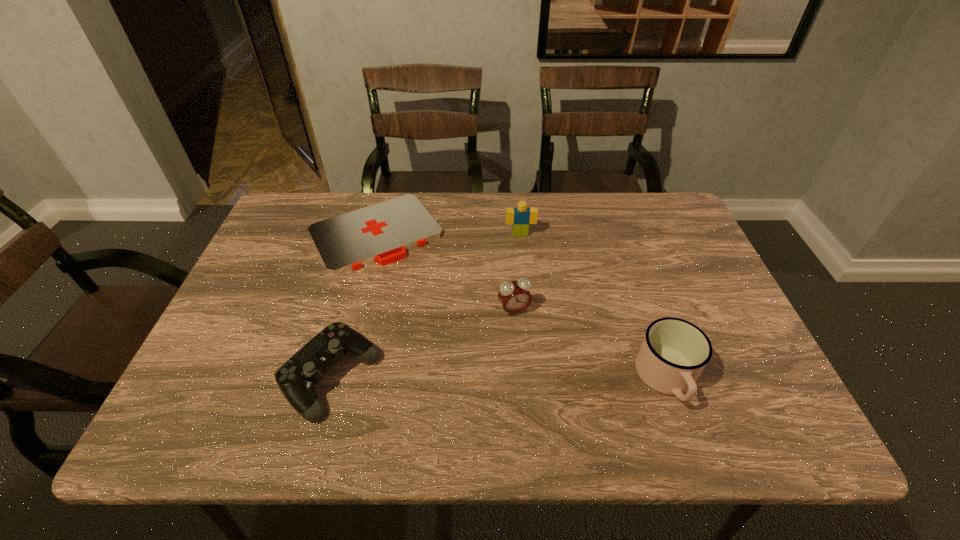
Find the location of a particular element. vacant point located 0.100m on the face of the Lego is located at coordinates (525, 261).

In order to click on free space located on the face of the Lego in this screenshot , I will do `click(533, 314)`.

Identify the location of vacant position located on the clock face of the third farthest object. (557, 393).

Find the location of a particular element. This screenshot has width=960, height=540. blank space located 0.220m on the clock face of the third farthest object is located at coordinates (559, 397).

What are the coordinates of `vacant space situated on the clock face of the third farthest object` in the screenshot? It's located at 549,377.

This screenshot has height=540, width=960. What are the coordinates of `the first-aid kit that is positioned at the far edge` in the screenshot? It's located at (381, 233).

Where is `Lego located in the far edge section of the desktop`? This screenshot has width=960, height=540. Lego located in the far edge section of the desktop is located at coordinates (520, 217).

Identify the location of control located in the near edge section of the desktop. (297, 377).

Locate an element on the screen. mug at the near edge is located at coordinates (674, 352).

What are the coordinates of `object present at the left edge` in the screenshot? It's located at (381, 233).